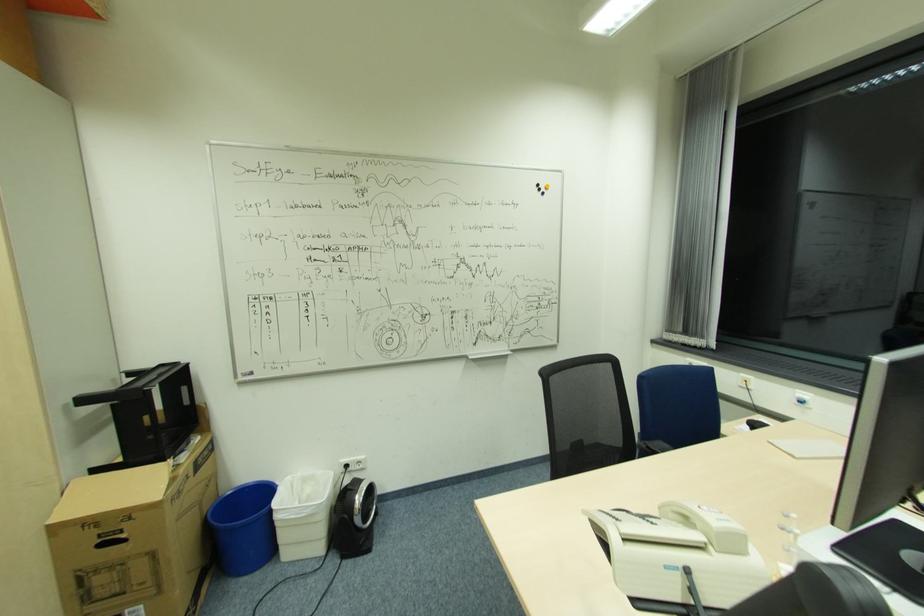
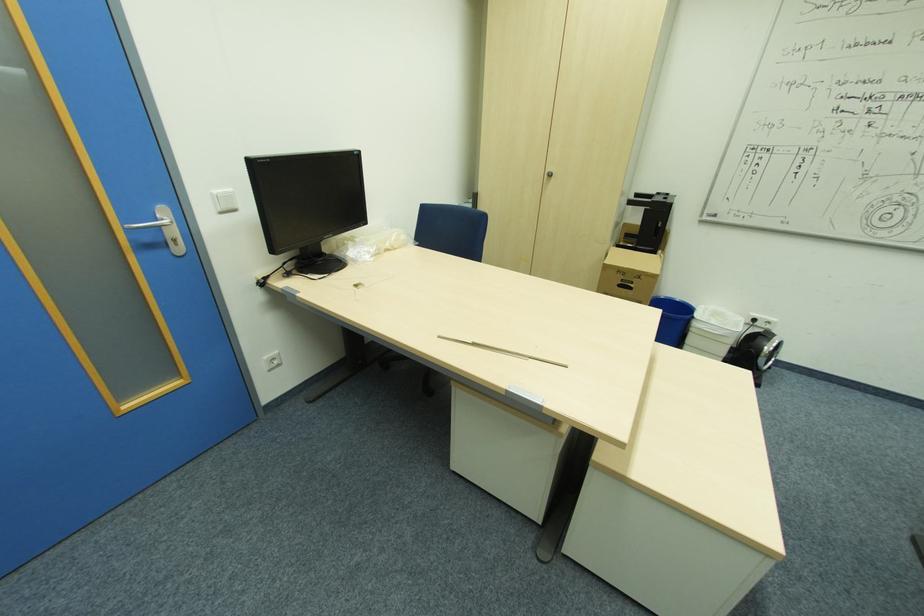
The point at (347, 515) is marked in the first image. Where is the corresponding point in the second image?

(755, 350)